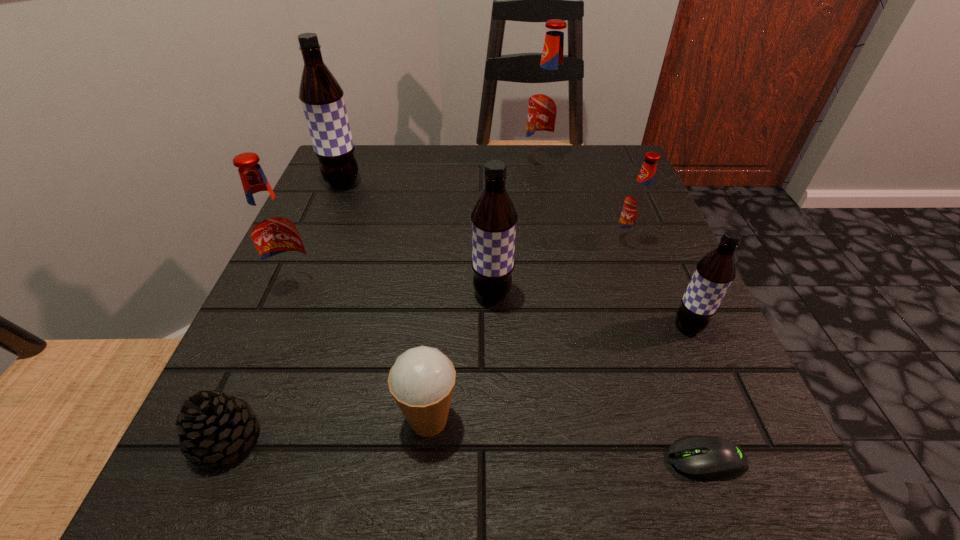
Locate an element on the screen. the farthest root beer is located at coordinates (548, 98).

At what (x,y) coordinates should I click in order to perform the action: click on the third root beer from right to left. Please return your answer as a coordinate pair (x, y). Looking at the image, I should click on (548, 98).

What are the coordinates of `the leftmost brown root beer` in the screenshot? It's located at (322, 99).

This screenshot has width=960, height=540. I want to click on the farthest brown root beer, so click(322, 99).

Identify the location of the second nearest brown root beer. The image size is (960, 540). (494, 217).

Where is `the fourth root beer from right to left`? The height and width of the screenshot is (540, 960). the fourth root beer from right to left is located at coordinates (494, 217).

Find the location of a particular element. The image size is (960, 540). the second biggest red root beer is located at coordinates (272, 228).

In order to click on the leftmost red root beer in this screenshot , I will do `click(272, 228)`.

This screenshot has width=960, height=540. In order to click on the fourth nearest root beer in this screenshot , I will do `click(639, 201)`.

Locate an element on the screen. The image size is (960, 540). the rightmost red root beer is located at coordinates pyautogui.click(x=639, y=201).